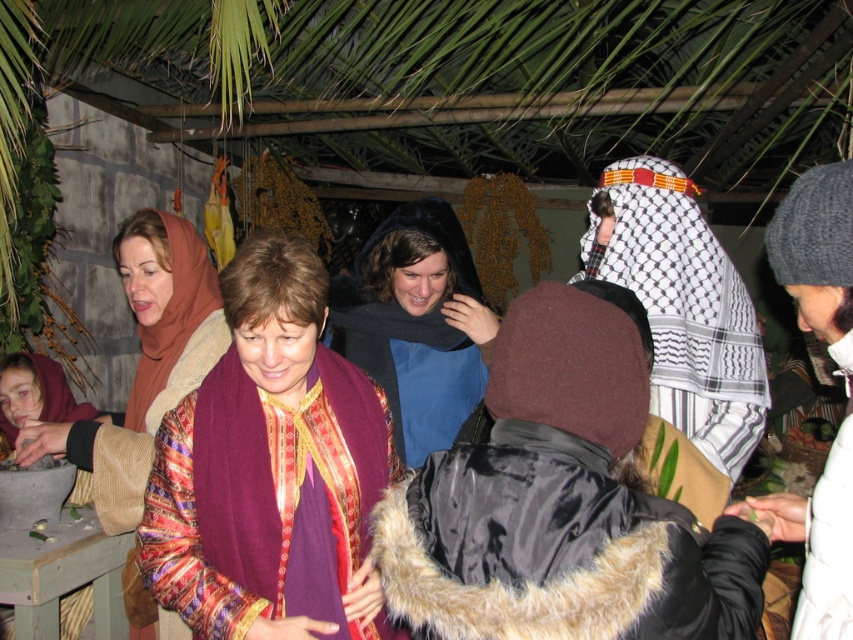
You are a photographer at the event and want to capture the shiny purple scarf at center and the black satin coat at center in a single shot. Which object should you focus on first to ensure both are in frame?

The shiny purple scarf at center is positioned over the black satin coat at center, so focusing on the shiny purple scarf at center first will ensure both are in frame.

You are a photographer at the event and want to capture both the shiny purple scarf at center and the multicolored fabric scarf at center in a single frame. Which scarf should you focus on to ensure both are visible without needing to adjust your camera angle?

The shiny purple scarf at center is shorter than the multicolored fabric scarf at center, so focusing on the multicolored fabric scarf at center would allow both to be visible in the frame without adjusting the camera angle.